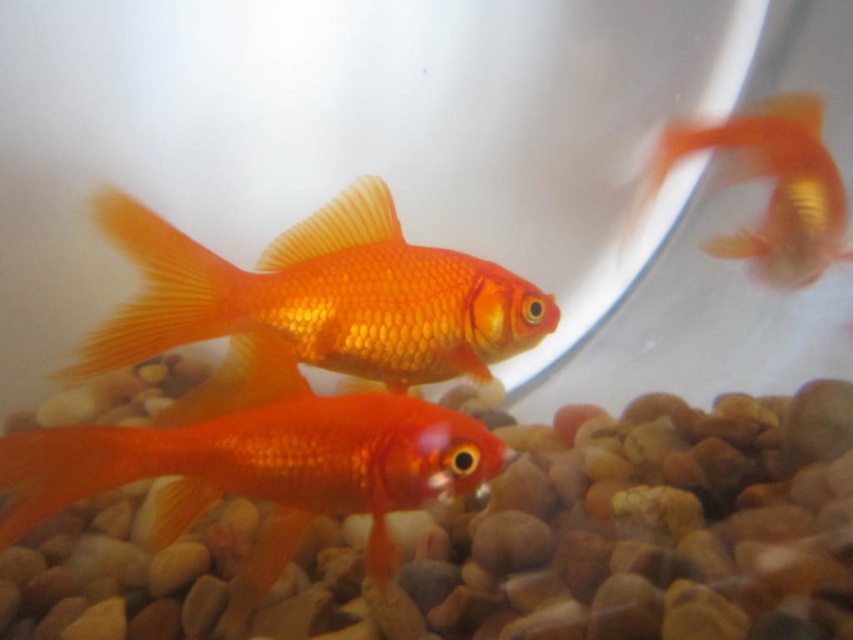
Question: Is shiny orange fish at center below shiny orange goldfish at center?

Choices:
 (A) yes
 (B) no

Answer: (A)

Question: Which point is farther to the camera?

Choices:
 (A) (236, 378)
 (B) (747, 173)

Answer: (B)

Question: Is shiny orange fish at center closer to the viewer compared to shiny orange goldfish at center?

Choices:
 (A) no
 (B) yes

Answer: (B)

Question: Which point is farther from the camera taking this photo?

Choices:
 (A) (733, 147)
 (B) (228, 451)

Answer: (A)

Question: Among these points, which one is nearest to the camera?

Choices:
 (A) (757, 260)
 (B) (207, 404)

Answer: (B)

Question: In this image, where is shiny orange fish at center located relative to shiny orange goldfish at center?

Choices:
 (A) below
 (B) above

Answer: (A)